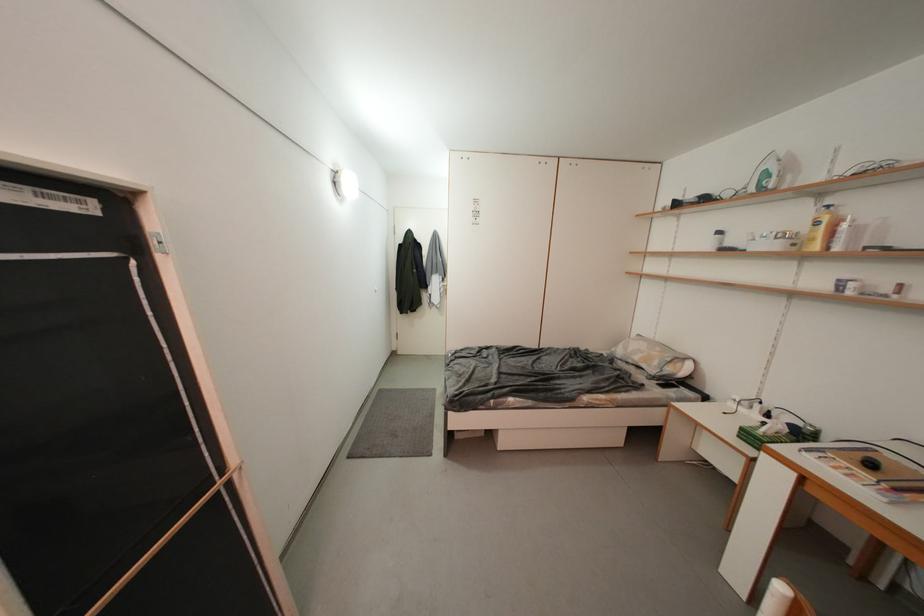
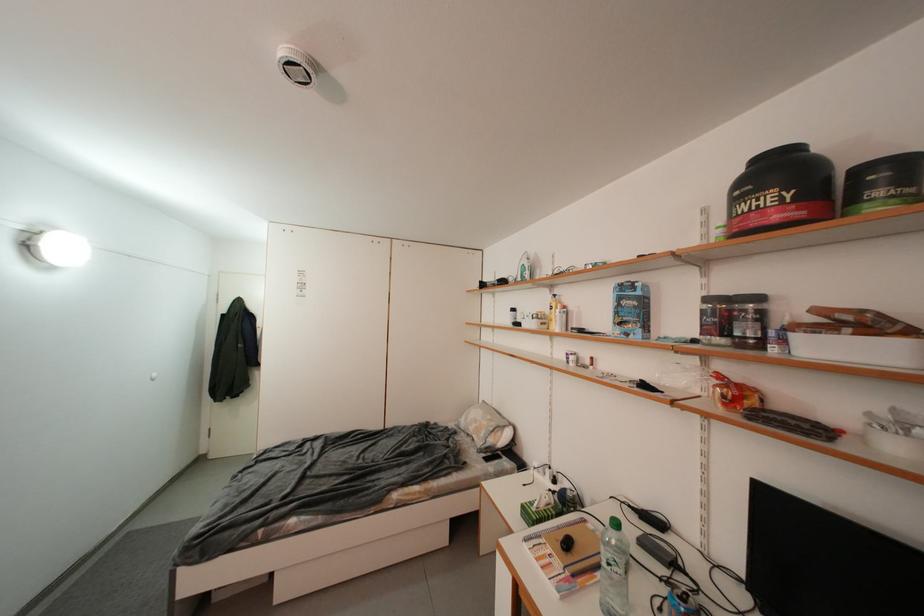
Question: Based on the continuous images, in which direction is the camera rotating? Reply with the corresponding letter.

Choices:
 (A) Left
 (B) Right
 (C) Up
 (D) Down

Answer: (B)